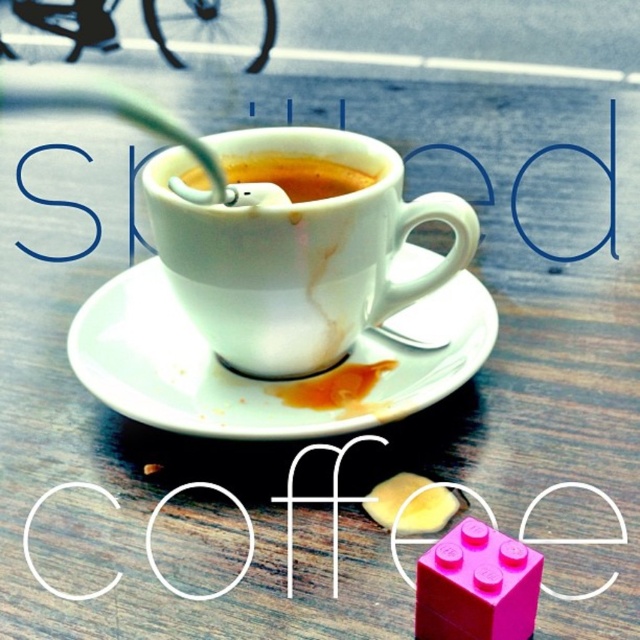
Between white ceramic saucer at center and smooth porcelain cup at center, which one has more height?

white ceramic saucer at center

Measure the distance between white ceramic saucer at center and camera.

They are 28.89 inches apart.

This screenshot has height=640, width=640. Identify the location of white ceramic saucer at center. (257, 380).

Which is more to the left, white ceramic cup at center or white ceramic saucer at center?

white ceramic saucer at center

Is white ceramic cup at center closer to the viewer compared to white ceramic saucer at center?

Yes, white ceramic cup at center is in front of white ceramic saucer at center.

Does point (260, 132) come farther from viewer compared to point (234, 401)?

That is True.

Locate an element on the screen. white ceramic cup at center is located at coordinates (292, 243).

Does white ceramic cup at center have a lesser height compared to smooth porcelain cup at center?

No, white ceramic cup at center is not shorter than smooth porcelain cup at center.

Is point (291, 317) behind point (266, 168)?

No, it is not.

Is point (212, 240) positioned before point (285, 156)?

Yes, point (212, 240) is closer to viewer.

The image size is (640, 640). In order to click on white ceramic cup at center in this screenshot , I will do `click(292, 243)`.